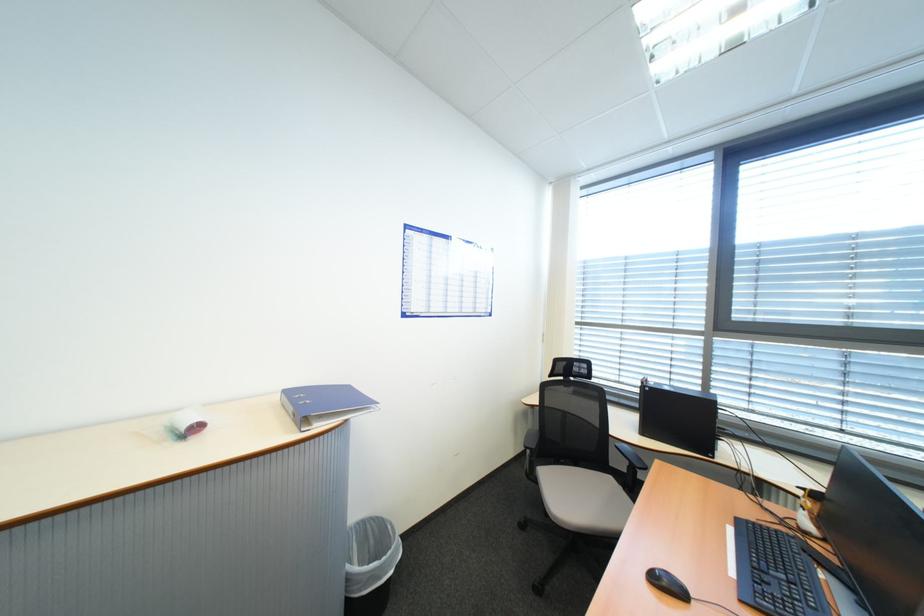
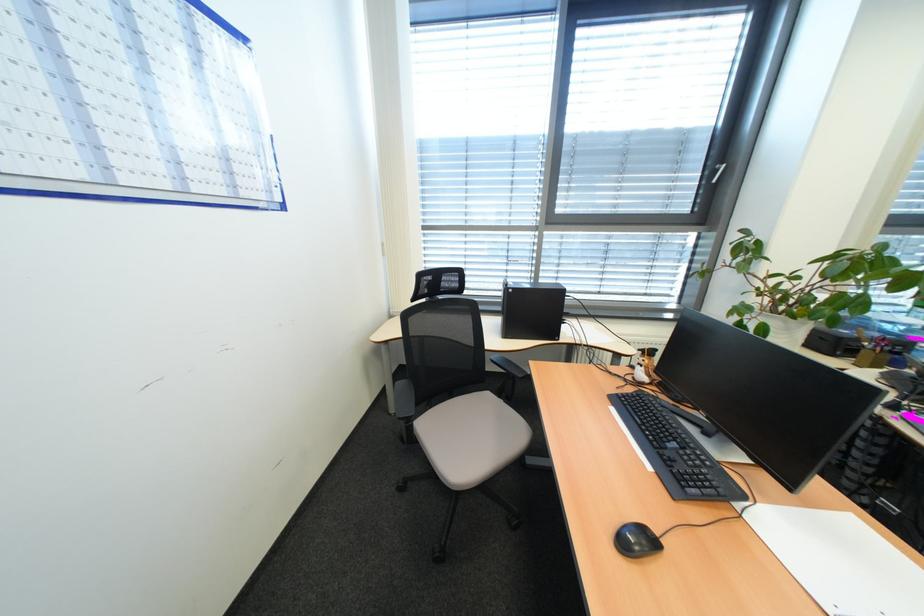
Where in the second image is the point corresponding to point (626, 448) from the first image?

(503, 362)